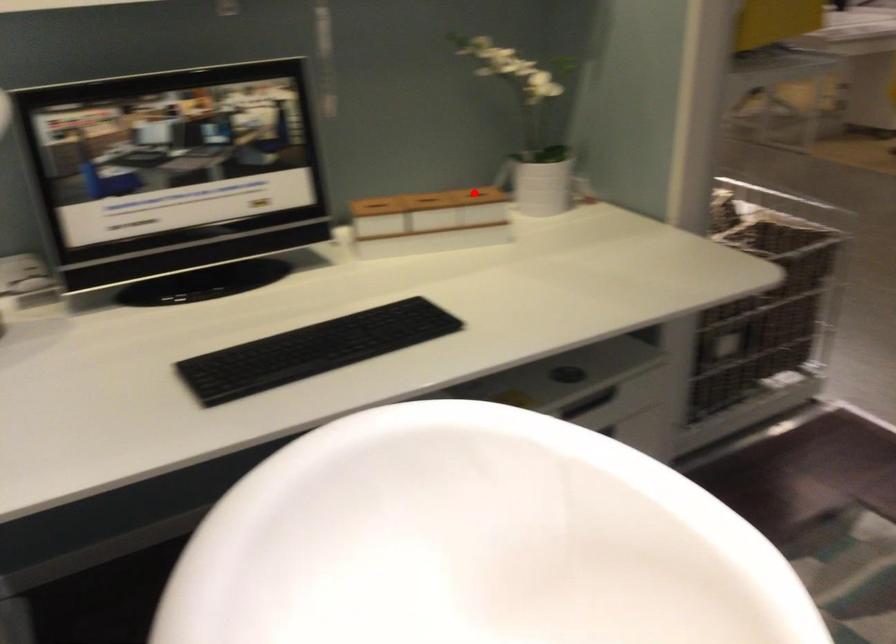
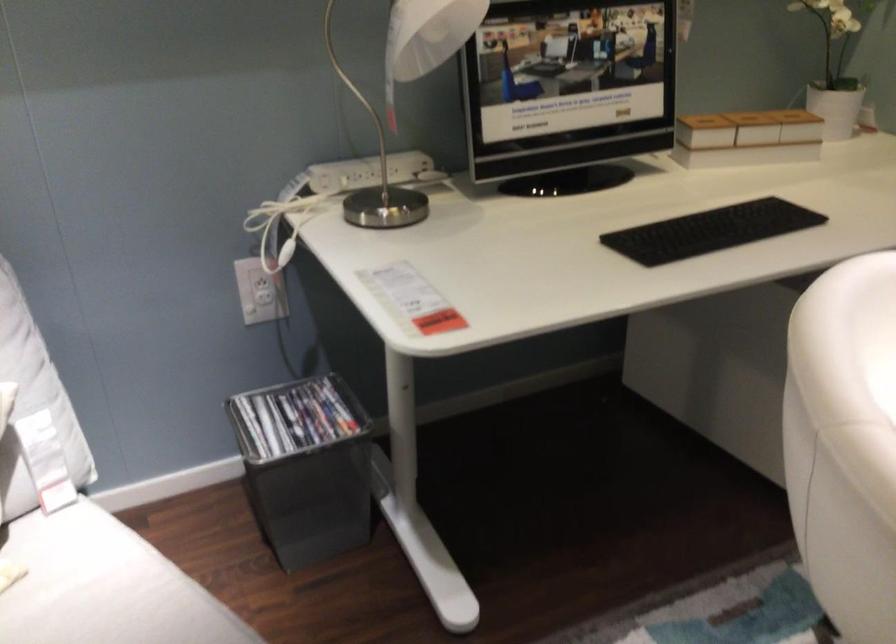
Question: A red point is marked in image1. In image2, is the corresponding 3D point closer to the camera or farther? Reply with the corresponding letter.

Choices:
 (A) The corresponding 3D point is closer.
 (B) The corresponding 3D point is farther.

Answer: (B)